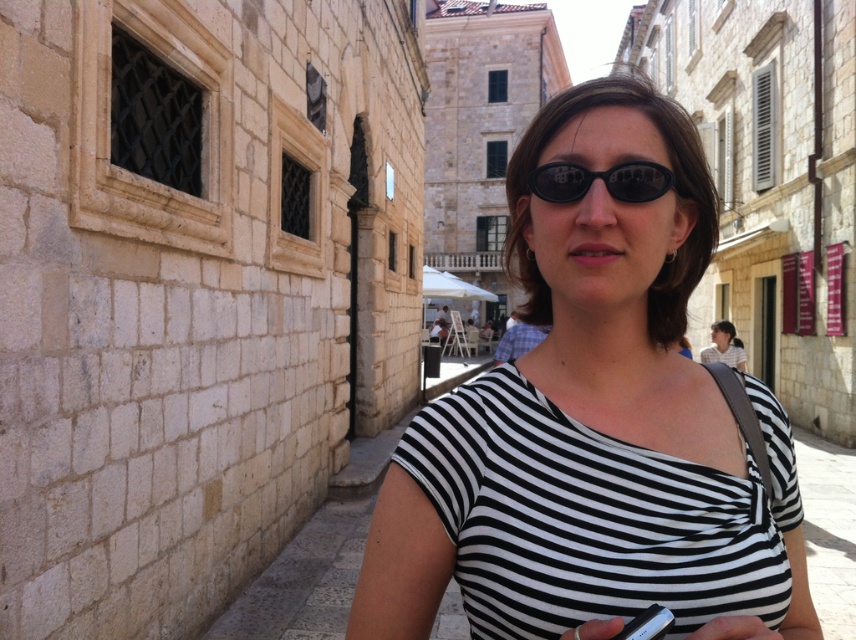
Who is shorter, black and white striped shirt at center or black matte sunglasses at center?

black matte sunglasses at center is shorter.

Can you confirm if black and white striped shirt at center is wider than black matte sunglasses at center?

Yes.

Is point (593, 298) farther from viewer compared to point (562, 188)?

No, (593, 298) is closer to viewer.

Where is `black and white striped shirt at center`? black and white striped shirt at center is located at coordinates (593, 426).